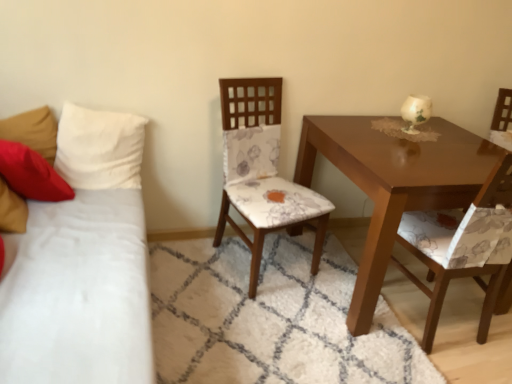
Locate an element on the screen. This screenshot has height=384, width=512. vacant space positioned to the left of floral fabric chair at center, the first chair viewed from the left is located at coordinates (186, 264).